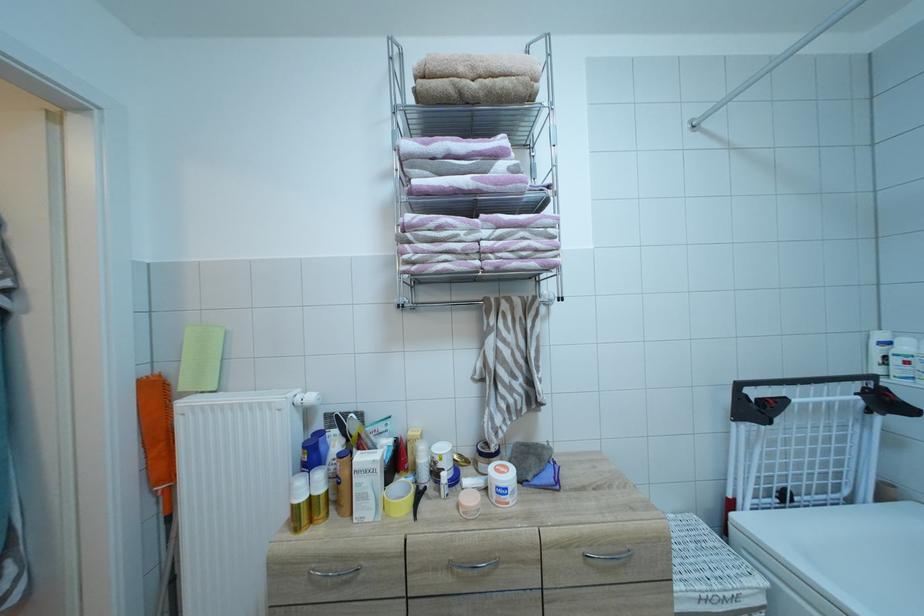
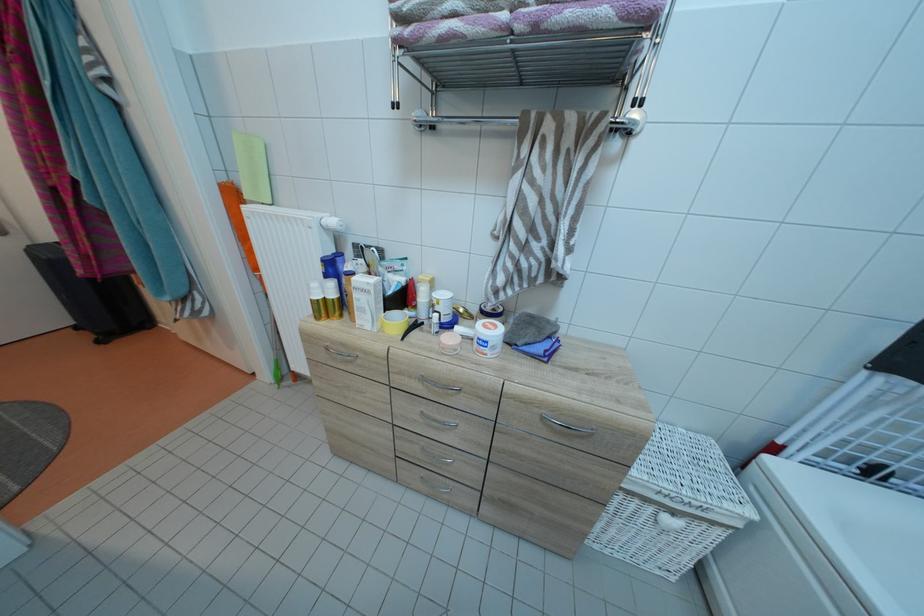
The point at (511, 477) is marked in the first image. Where is the corresponding point in the second image?

(496, 334)